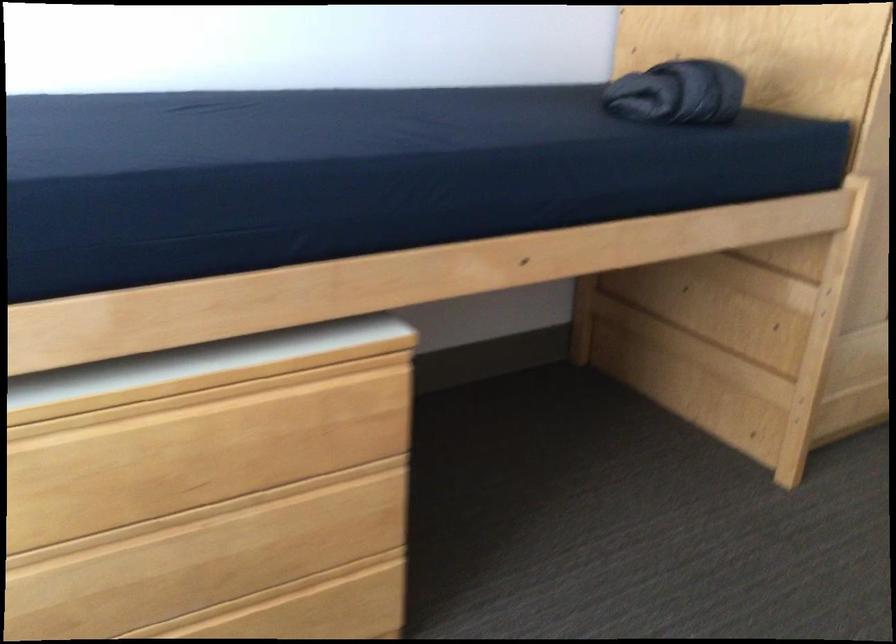
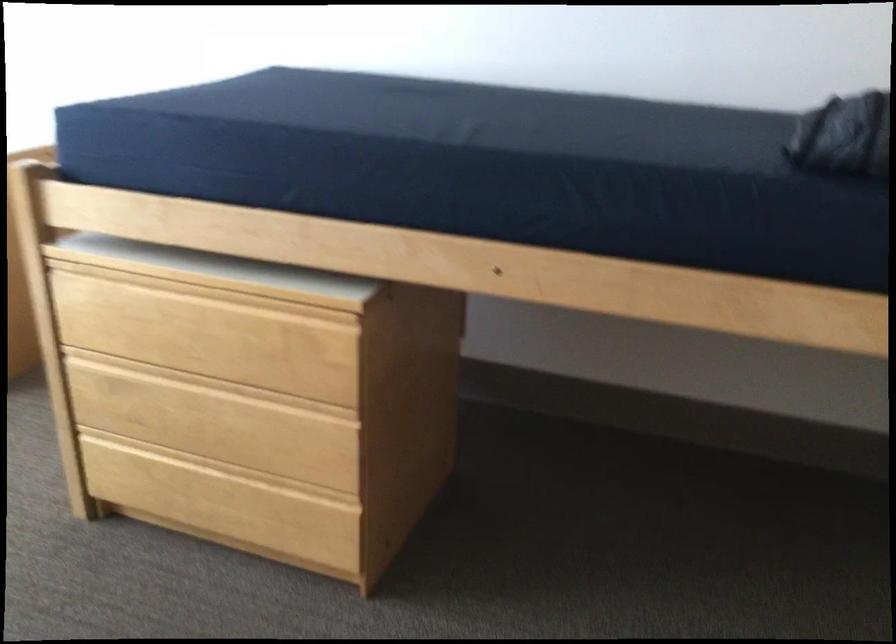
Find the pixel in the second image that matches [169,523] in the first image.

(194, 381)